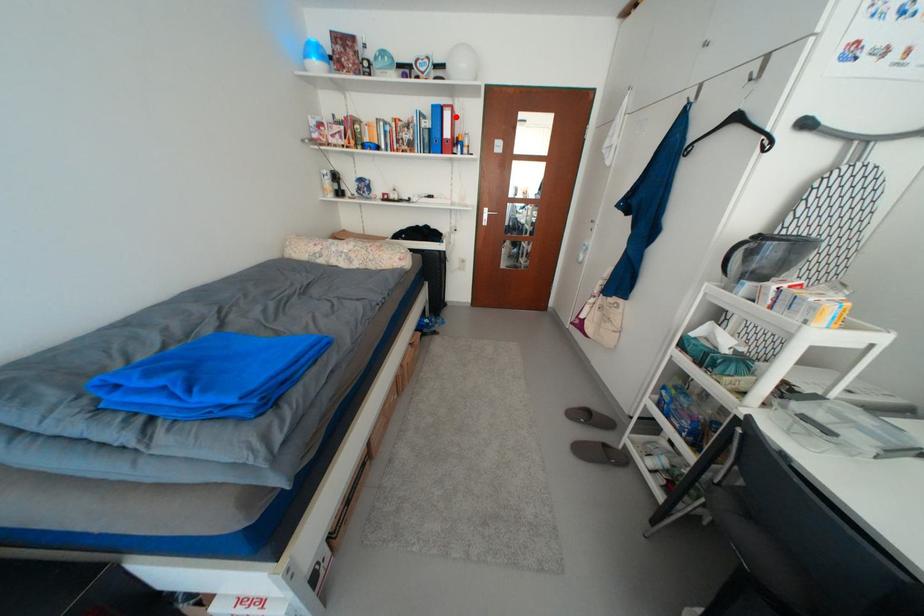
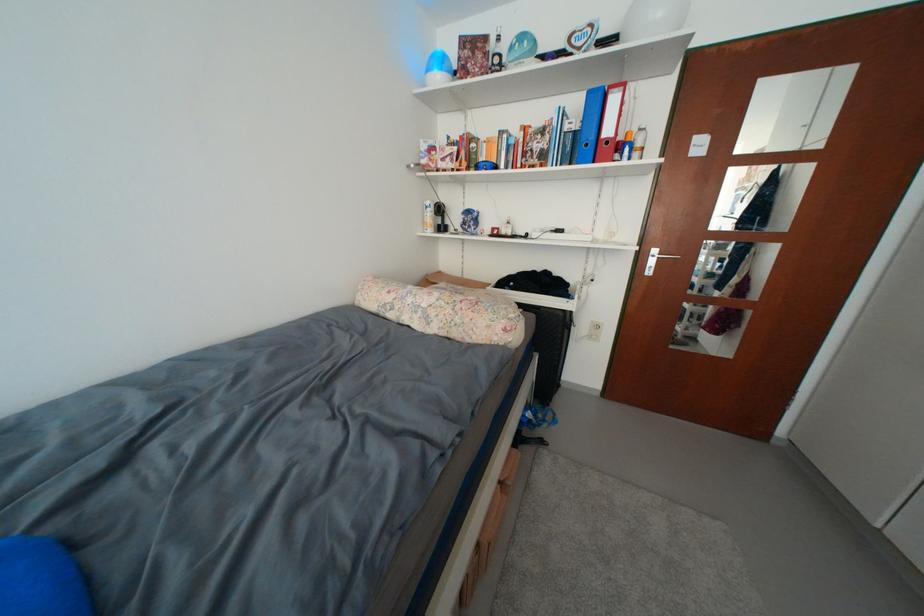
Question: I am providing you with two images of the same scene from different viewpoints. A red point is marked on the first image. Can you still see the location of the red point in image 2?

Choices:
 (A) Yes
 (B) No

Answer: (A)